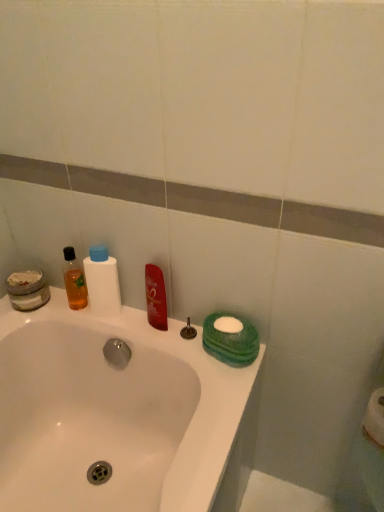
Where is `white matte bottle at upper left`? This screenshot has width=384, height=512. white matte bottle at upper left is located at coordinates (102, 282).

What do you see at coordinates (102, 282) in the screenshot?
I see `white matte bottle at upper left` at bounding box center [102, 282].

Where is `white matte bottle at upper left`? The width and height of the screenshot is (384, 512). white matte bottle at upper left is located at coordinates (102, 282).